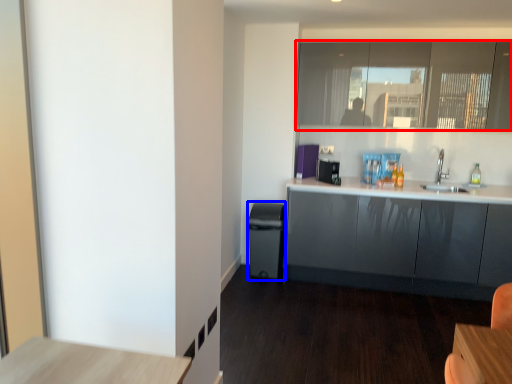
Question: Which object appears closest to the camera in this image, window (highlighted by a red box) or dish washer (highlighted by a blue box)?

Choices:
 (A) window
 (B) dish washer

Answer: (A)